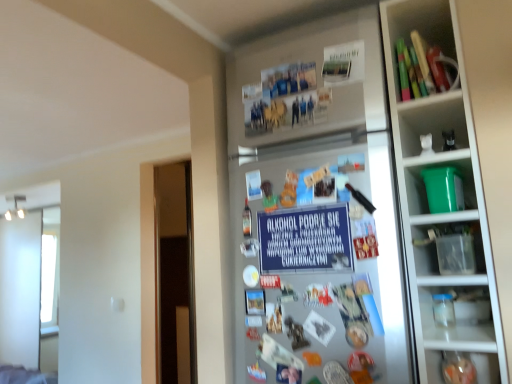
At what (x,y) coordinates should I click in order to perform the action: click on blue paper sign at center. Please return your answer as a coordinate pair (x, y). This screenshot has width=512, height=384. Looking at the image, I should click on (305, 239).

This screenshot has height=384, width=512. Describe the element at coordinates (305, 239) in the screenshot. I see `blue paper sign at center` at that location.

This screenshot has height=384, width=512. Describe the element at coordinates (437, 166) in the screenshot. I see `green plastic bucket at right, which is counted as the 2th shelf, starting from the top` at that location.

How much space does wooden blocks at upper right, positioned as the first shelf in top-to-bottom order, occupy horizontally?

The width of wooden blocks at upper right, positioned as the first shelf in top-to-bottom order, is 5.28 inches.

What do you see at coordinates (418, 26) in the screenshot?
I see `wooden blocks at upper right, positioned as the first shelf in top-to-bottom order` at bounding box center [418, 26].

What do you see at coordinates (315, 210) in the screenshot? I see `silver metallic fridge at center` at bounding box center [315, 210].

Identify the location of blue paper sign at center. (305, 239).

Can you confirm if blue paper sign at center is shorter than silver metallic fridge at center?

Yes.

Is blue paper sign at center with silver metallic fridge at center?

They are not placed beside each other.

Which object is positioned more to the left, blue paper sign at center or silver metallic fridge at center?

Positioned to the left is blue paper sign at center.

From the image's perspective, is blue paper sign at center located above or below silver metallic fridge at center?

blue paper sign at center is above silver metallic fridge at center.

Identify the location of shelf that is the 2nd object located above the blue paper sign at center (from the image's perspective). The height and width of the screenshot is (384, 512). (418, 26).

Can we say blue paper sign at center lies outside wooden blocks at upper right, which is counted as the second shelf, starting from the bottom?

blue paper sign at center is positioned outside wooden blocks at upper right, which is counted as the second shelf, starting from the bottom.

Does point (302, 209) lie behind point (397, 81)?

Yes.

Can you tell me how much blue paper sign at center and wooden blocks at upper right, positioned as the first shelf in top-to-bottom order, differ in facing direction?

0.772 degrees.

From the image's perspective, is silver metallic fridge at center located beneath blue paper sign at center?

Yes, from the image's perspective, silver metallic fridge at center is beneath blue paper sign at center.

Does silver metallic fridge at center have a lesser width compared to blue paper sign at center?

No, silver metallic fridge at center is not thinner than blue paper sign at center.

Would you say silver metallic fridge at center is a long distance from blue paper sign at center?

They are positioned close to each other.

How distant is silver metallic fridge at center from blue paper sign at center?

A distance of 5.71 inches exists between silver metallic fridge at center and blue paper sign at center.

Looking at their sizes, would you say wooden blocks at upper right, positioned as the first shelf in top-to-bottom order, is wider or thinner than green plastic bucket at right, positioned as the 1th shelf in bottom-to-top order?

Clearly, wooden blocks at upper right, positioned as the first shelf in top-to-bottom order, has less width compared to green plastic bucket at right, positioned as the 1th shelf in bottom-to-top order.

Is wooden blocks at upper right, positioned as the first shelf in top-to-bottom order, oriented away from green plastic bucket at right, positioned as the 1th shelf in bottom-to-top order?

That's not correct — wooden blocks at upper right, positioned as the first shelf in top-to-bottom order, is not looking away from green plastic bucket at right, positioned as the 1th shelf in bottom-to-top order.

Are wooden blocks at upper right, positioned as the first shelf in top-to-bottom order, and green plastic bucket at right, positioned as the 1th shelf in bottom-to-top order, located far from each other?

Answer: No.

From the image's perspective, is green plastic bucket at right, positioned as the 1th shelf in bottom-to-top order, positioned above or below blue paper sign at center?

Clearly, from the image's perspective, green plastic bucket at right, positioned as the 1th shelf in bottom-to-top order, is above blue paper sign at center.

From their relative heights in the image, would you say green plastic bucket at right, which is counted as the 2th shelf, starting from the top, is taller or shorter than blue paper sign at center?

Clearly, green plastic bucket at right, which is counted as the 2th shelf, starting from the top, is shorter compared to blue paper sign at center.

Looking at this image, considering the relative sizes of green plastic bucket at right, which is counted as the 2th shelf, starting from the top, and blue paper sign at center in the image provided, is green plastic bucket at right, which is counted as the 2th shelf, starting from the top, bigger than blue paper sign at center?

Correct, green plastic bucket at right, which is counted as the 2th shelf, starting from the top, is larger in size than blue paper sign at center.

Looking at this image, which of these two, silver metallic fridge at center or green plastic bucket at right, which is counted as the 2th shelf, starting from the top, is thinner?

silver metallic fridge at center.

Consider the image. Who is bigger, silver metallic fridge at center or green plastic bucket at right, which is counted as the 2th shelf, starting from the top?

silver metallic fridge at center.

From a real-world perspective, is silver metallic fridge at center under green plastic bucket at right, positioned as the 1th shelf in bottom-to-top order?

Yes.

Is silver metallic fridge at center far from green plastic bucket at right, positioned as the 1th shelf in bottom-to-top order?

Actually, silver metallic fridge at center and green plastic bucket at right, positioned as the 1th shelf in bottom-to-top order, are a little close together.

From the image's perspective, which is above, green plastic bucket at right, which is counted as the 2th shelf, starting from the top, or silver metallic fridge at center?

green plastic bucket at right, which is counted as the 2th shelf, starting from the top.

Considering the sizes of objects green plastic bucket at right, which is counted as the 2th shelf, starting from the top, and silver metallic fridge at center in the image provided, who is smaller, green plastic bucket at right, which is counted as the 2th shelf, starting from the top, or silver metallic fridge at center?

green plastic bucket at right, which is counted as the 2th shelf, starting from the top.

Which is nearer, (470, 164) or (390, 216)?

Clearly, point (470, 164) is more distant from the camera than point (390, 216).

Starting from the silver metallic fridge at center, which shelf is the 1st one behind? Please provide its 2D coordinates.

[(437, 166)]

This screenshot has height=384, width=512. What are the coordinates of `writing that appears above the silver metallic fridge at center (from a real-world perspective)` in the screenshot? It's located at (305, 239).

Identify the location of writing below the wooden blocks at upper right, positioned as the first shelf in top-to-bottom order (from the image's perspective). Image resolution: width=512 pixels, height=384 pixels. (305, 239).

Looking at the image, which one is located further to blue paper sign at center, green plastic bucket at right, positioned as the 1th shelf in bottom-to-top order, or silver metallic fridge at center?

green plastic bucket at right, positioned as the 1th shelf in bottom-to-top order.

From the image, which object appears to be nearer to blue paper sign at center, silver metallic fridge at center or green plastic bucket at right, which is counted as the 2th shelf, starting from the top?

silver metallic fridge at center lies closer to blue paper sign at center than the other object.

Looking at the image, which one is located further to wooden blocks at upper right, which is counted as the second shelf, starting from the bottom, green plastic bucket at right, which is counted as the 2th shelf, starting from the top, or silver metallic fridge at center?

The object further to wooden blocks at upper right, which is counted as the second shelf, starting from the bottom, is green plastic bucket at right, which is counted as the 2th shelf, starting from the top.

Estimate the real-world distances between objects in this image. Which object is further from silver metallic fridge at center, blue paper sign at center or green plastic bucket at right, positioned as the 1th shelf in bottom-to-top order?

green plastic bucket at right, positioned as the 1th shelf in bottom-to-top order, lies further to silver metallic fridge at center than the other object.

From the image, which object appears to be farther from silver metallic fridge at center, green plastic bucket at right, positioned as the 1th shelf in bottom-to-top order, or wooden blocks at upper right, positioned as the first shelf in top-to-bottom order?

wooden blocks at upper right, positioned as the first shelf in top-to-bottom order, is further to silver metallic fridge at center.

Which object lies further to the anchor point blue paper sign at center, wooden blocks at upper right, positioned as the first shelf in top-to-bottom order, or silver metallic fridge at center?

Among the two, wooden blocks at upper right, positioned as the first shelf in top-to-bottom order, is located further to blue paper sign at center.

Which object lies further to the anchor point green plastic bucket at right, which is counted as the 2th shelf, starting from the top, blue paper sign at center or silver metallic fridge at center?

Based on the image, silver metallic fridge at center appears to be further to green plastic bucket at right, which is counted as the 2th shelf, starting from the top.

Considering their positions, is wooden blocks at upper right, which is counted as the second shelf, starting from the bottom, positioned further to green plastic bucket at right, which is counted as the 2th shelf, starting from the top, than blue paper sign at center?

The object further to green plastic bucket at right, which is counted as the 2th shelf, starting from the top, is wooden blocks at upper right, which is counted as the second shelf, starting from the bottom.

Where is `fridge located between blue paper sign at center and green plastic bucket at right, which is counted as the 2th shelf, starting from the top, in the left-right direction`? fridge located between blue paper sign at center and green plastic bucket at right, which is counted as the 2th shelf, starting from the top, in the left-right direction is located at coordinates pyautogui.click(x=315, y=210).

Where is `writing that lies between wooden blocks at upper right, which is counted as the second shelf, starting from the bottom, and silver metallic fridge at center from top to bottom`? writing that lies between wooden blocks at upper right, which is counted as the second shelf, starting from the bottom, and silver metallic fridge at center from top to bottom is located at coordinates (305, 239).

I want to click on shelf that lies between wooden blocks at upper right, positioned as the first shelf in top-to-bottom order, and blue paper sign at center from top to bottom, so click(x=437, y=166).

The height and width of the screenshot is (384, 512). In order to click on shelf between wooden blocks at upper right, positioned as the first shelf in top-to-bottom order, and silver metallic fridge at center in the up-down direction in this screenshot , I will do `click(437, 166)`.